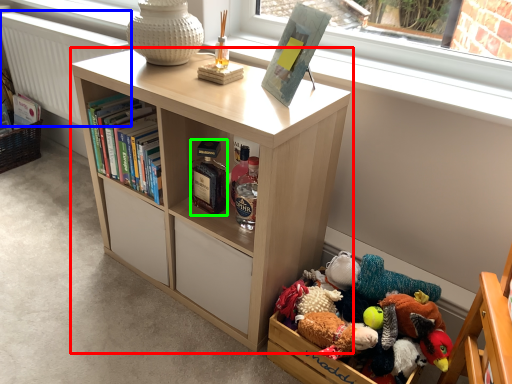
Question: Considering the real-world distances, which object is farthest from bookcase (highlighted by a red box)? radiator (highlighted by a blue box) or bottle (highlighted by a green box)?

Choices:
 (A) radiator
 (B) bottle

Answer: (A)